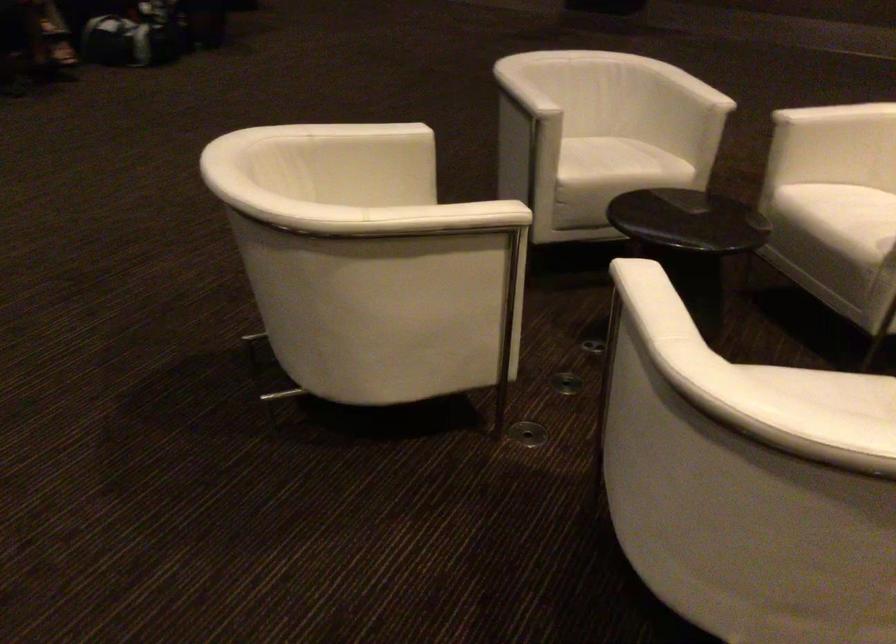
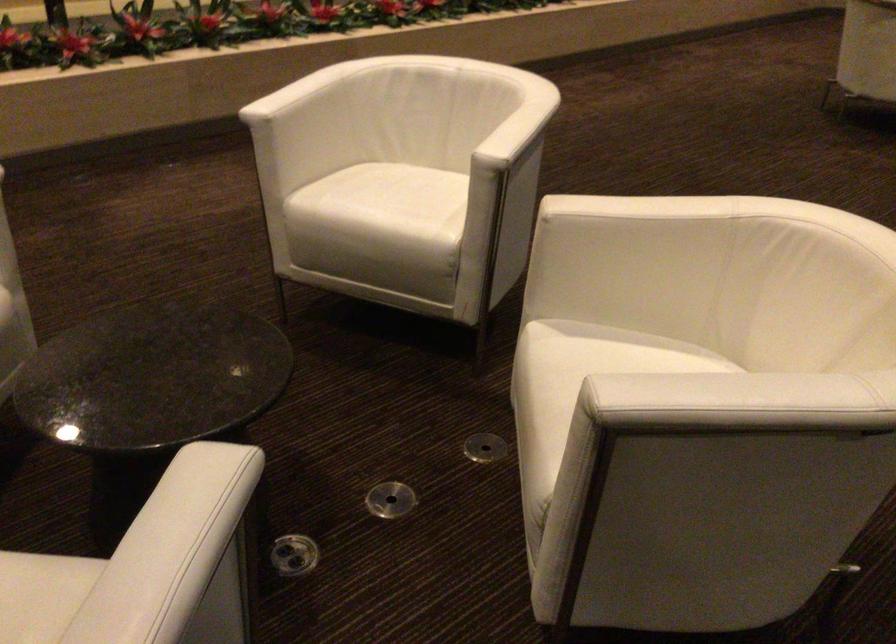
Find the pixel in the second image that matches (528,431) in the first image.

(484, 447)